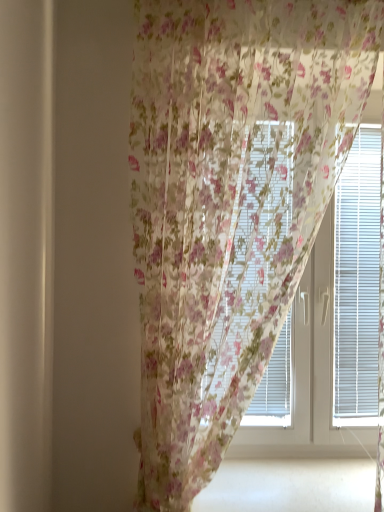
What do you see at coordinates (229, 203) in the screenshot? I see `floral sheer curtain at center` at bounding box center [229, 203].

Find the location of `floral sheer curtain at center`. floral sheer curtain at center is located at coordinates (229, 203).

The height and width of the screenshot is (512, 384). What do you see at coordinates (309, 373) in the screenshot?
I see `translucent floral curtain at center` at bounding box center [309, 373].

What is the approximate width of translucent floral curtain at center?

translucent floral curtain at center is 8.25 centimeters in width.

You are a GUI agent. You are given a task and a screenshot of the screen. Output one action in this format:
    pyautogui.click(x=<x>, y=<y>)
    Task: Click on the translucent floral curtain at center
    The image size is (384, 512).
    Given the screenshot: What is the action you would take?
    pyautogui.click(x=309, y=373)

This screenshot has height=512, width=384. Find the location of `floral sheer curtain at center`. floral sheer curtain at center is located at coordinates (229, 203).

Which is more to the right, floral sheer curtain at center or translucent floral curtain at center?

translucent floral curtain at center.

Does floral sheer curtain at center come behind translucent floral curtain at center?

No, it is in front of translucent floral curtain at center.

Is point (152, 378) farther from viewer compared to point (257, 400)?

No.

From the image's perspective, is floral sheer curtain at center located beneath translucent floral curtain at center?

Actually, floral sheer curtain at center appears above translucent floral curtain at center in the image.

From a real-world perspective, is floral sheer curtain at center positioned above or below translucent floral curtain at center?

floral sheer curtain at center is above translucent floral curtain at center.

Considering the sizes of objects floral sheer curtain at center and translucent floral curtain at center in the image provided, who is wider, floral sheer curtain at center or translucent floral curtain at center?

floral sheer curtain at center is wider.

From their relative heights in the image, would you say floral sheer curtain at center is taller or shorter than translucent floral curtain at center?

Clearly, floral sheer curtain at center is taller compared to translucent floral curtain at center.

In the scene shown: Between floral sheer curtain at center and translucent floral curtain at center, which one has larger size?

Bigger between the two is floral sheer curtain at center.

Looking at this image, could translucent floral curtain at center be considered to be inside floral sheer curtain at center?

No, translucent floral curtain at center is not a part of floral sheer curtain at center.

Is floral sheer curtain at center directly adjacent to translucent floral curtain at center?

No, floral sheer curtain at center is not making contact with translucent floral curtain at center.

Is translucent floral curtain at center at the back of floral sheer curtain at center?

Yes, translucent floral curtain at center is at the back of floral sheer curtain at center.

How many degrees apart are the facing directions of floral sheer curtain at center and translucent floral curtain at center?

0.779 degrees separate the facing orientations of floral sheer curtain at center and translucent floral curtain at center.

Locate an element on the screen. The image size is (384, 512). curtain above the translucent floral curtain at center (from a real-world perspective) is located at coordinates (229, 203).

Does translucent floral curtain at center appear on the left side of floral sheer curtain at center?

No.

Is translucent floral curtain at center positioned behind floral sheer curtain at center?

Yes, translucent floral curtain at center is further from the camera.

Which is farther from the camera, [299,321] or [280,302]?

Positioned behind is point [299,321].

From the image's perspective, is translucent floral curtain at center below floral sheer curtain at center?

Indeed, from the image's perspective, translucent floral curtain at center is shown beneath floral sheer curtain at center.

From a real-world perspective, which is physically above, translucent floral curtain at center or floral sheer curtain at center?

floral sheer curtain at center is physically above.

Can you confirm if translucent floral curtain at center is thinner than floral sheer curtain at center?

Correct, the width of translucent floral curtain at center is less than that of floral sheer curtain at center.

Considering the sizes of translucent floral curtain at center and floral sheer curtain at center in the image, is translucent floral curtain at center taller or shorter than floral sheer curtain at center?

Considering their sizes, translucent floral curtain at center has less height than floral sheer curtain at center.

Is translucent floral curtain at center bigger than floral sheer curtain at center?

Actually, translucent floral curtain at center might be smaller than floral sheer curtain at center.

Is translucent floral curtain at center located outside floral sheer curtain at center?

Yes, translucent floral curtain at center is not within floral sheer curtain at center.

Looking at this image, is translucent floral curtain at center placed right next to floral sheer curtain at center?

No, translucent floral curtain at center is not beside floral sheer curtain at center.

Is translucent floral curtain at center turned away from floral sheer curtain at center?

No, floral sheer curtain at center is not at the back of translucent floral curtain at center.

What's the angular difference between translucent floral curtain at center and floral sheer curtain at center's facing directions?

0.779 degrees separate the facing orientations of translucent floral curtain at center and floral sheer curtain at center.

This screenshot has width=384, height=512. Identify the location of curtain that appears above the translucent floral curtain at center (from the image's perspective). (229, 203).

Find the location of `bay window that appears below the floral sheer curtain at center (from a real-world perspective)`. bay window that appears below the floral sheer curtain at center (from a real-world perspective) is located at coordinates (309, 373).

The image size is (384, 512). I want to click on curtain located on the left of translucent floral curtain at center, so click(x=229, y=203).